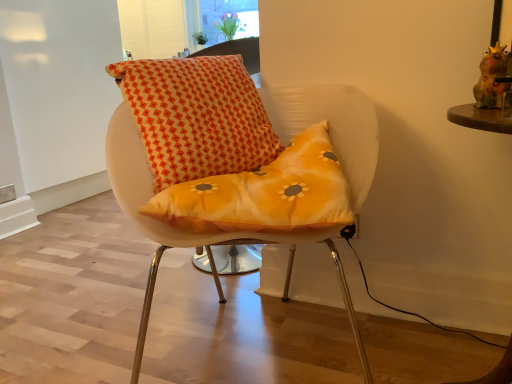
Question: Can you see orange printed cushion at upper center touching brown wooden table at right?

Choices:
 (A) no
 (B) yes

Answer: (A)

Question: Is orange printed cushion at upper center bigger than brown wooden table at right?

Choices:
 (A) no
 (B) yes

Answer: (B)

Question: Does orange printed cushion at upper center have a greater height compared to brown wooden table at right?

Choices:
 (A) yes
 (B) no

Answer: (B)

Question: Does orange printed cushion at upper center have a smaller size compared to brown wooden table at right?

Choices:
 (A) no
 (B) yes

Answer: (A)

Question: Can you confirm if orange printed cushion at upper center is thinner than brown wooden table at right?

Choices:
 (A) yes
 (B) no

Answer: (A)

Question: Is point (194, 18) positioned closer to the camera than point (162, 221)?

Choices:
 (A) farther
 (B) closer

Answer: (A)

Question: Based on their sizes in the image, would you say transparent glass window at upper center is bigger or smaller than matte orange cushion at center?

Choices:
 (A) big
 (B) small

Answer: (B)

Question: Is transparent glass window at upper center to the left or to the right of matte orange cushion at center in the image?

Choices:
 (A) right
 (B) left

Answer: (B)

Question: From the image's perspective, is transparent glass window at upper center located above or below matte orange cushion at center?

Choices:
 (A) below
 (B) above

Answer: (B)

Question: Considering the positions of brown wooden table at right and matte orange cushion at center in the image, is brown wooden table at right taller or shorter than matte orange cushion at center?

Choices:
 (A) tall
 (B) short

Answer: (B)

Question: Based on their positions, is brown wooden table at right located to the left or right of matte orange cushion at center?

Choices:
 (A) right
 (B) left

Answer: (A)

Question: Considering the positions of point (459, 117) and point (126, 145), is point (459, 117) closer or farther from the camera than point (126, 145)?

Choices:
 (A) closer
 (B) farther

Answer: (A)

Question: From the image's perspective, is brown wooden table at right positioned above or below matte orange cushion at center?

Choices:
 (A) below
 (B) above

Answer: (A)

Question: From the image's perspective, relative to transparent glass window at upper center, is matte orange cushion at center above or below?

Choices:
 (A) above
 (B) below

Answer: (B)

Question: Which is correct: matte orange cushion at center is inside transparent glass window at upper center, or outside of it?

Choices:
 (A) outside
 (B) inside

Answer: (A)